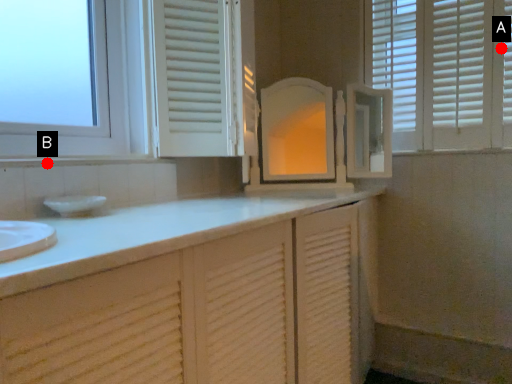
Question: Two points are circled on the image, labeled by A and B beside each circle. Among these points, which one is nearest to the camera?

Choices:
 (A) A is closer
 (B) B is closer

Answer: (B)